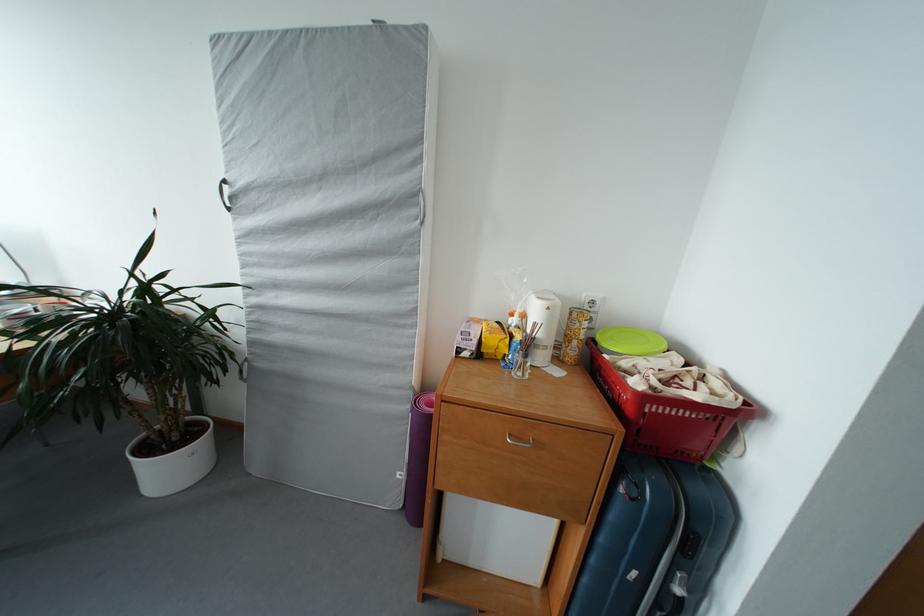
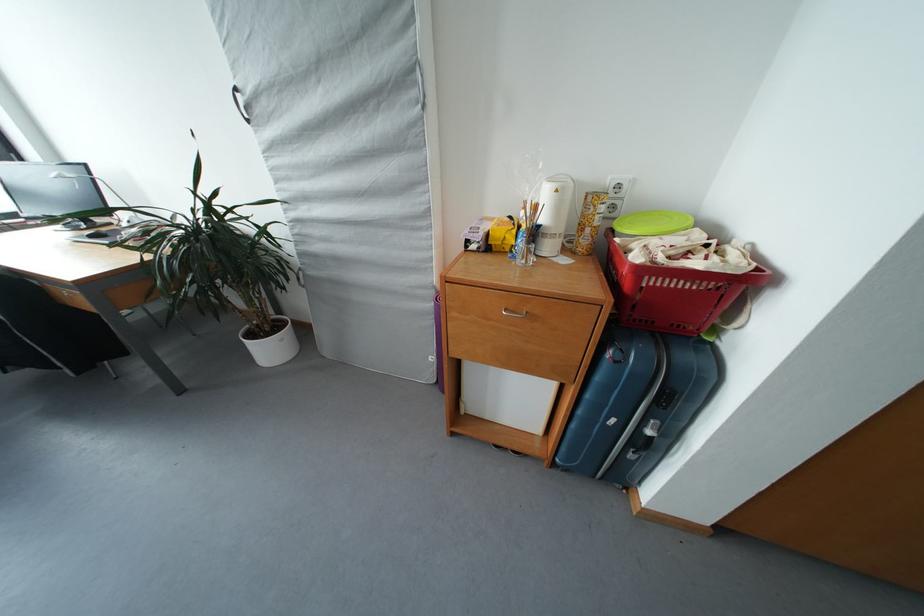
Locate, in the second image, the point that corresponds to (694,419) in the first image.

(694, 291)